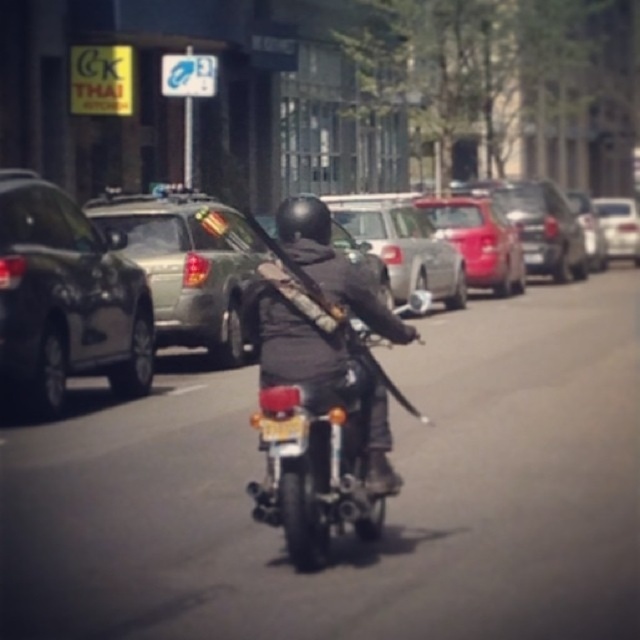
You are standing at the origin point of the image coordinate system. You see two points, point (12, 289) and point (51, 326). Which point is closer to you?

Point (12, 289) is in front of point (51, 326), so it is closer to you.